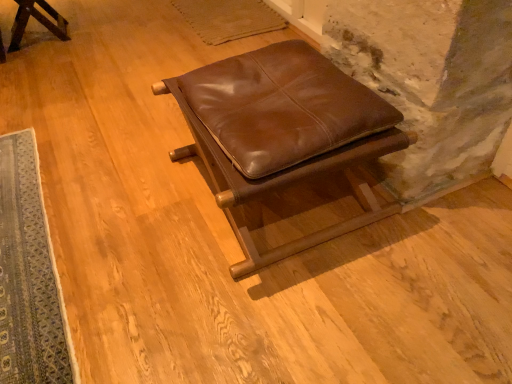
Measure the distance between matte brown leather stool at upper left, the first furniture when ordered from top to bottom, and camera.

They are 7.03 feet apart.

The width and height of the screenshot is (512, 384). Describe the element at coordinates (29, 275) in the screenshot. I see `blue woven rug at lower left` at that location.

Locate an element on the screen. Image resolution: width=512 pixels, height=384 pixels. matte brown leather stool at upper left, the 1th furniture viewed from the left is located at coordinates (37, 20).

Looking at the image, does blue woven rug at lower left seem bigger or smaller compared to brown leather ottoman at center, which appears as the first furniture when viewed from the front?

blue woven rug at lower left is smaller than brown leather ottoman at center, which appears as the first furniture when viewed from the front.

At what (x,y) coordinates should I click in order to perform the action: click on furniture in front of the blue woven rug at lower left. Please return your answer as a coordinate pair (x, y). The image size is (512, 384). Looking at the image, I should click on pyautogui.click(x=280, y=119).

Which is more to the left, blue woven rug at lower left or brown leather ottoman at center, arranged as the second furniture when viewed from the left?

From the viewer's perspective, blue woven rug at lower left appears more on the left side.

Is blue woven rug at lower left not close to brown leather ottoman at center, which is the first furniture in right-to-left order?

Actually, blue woven rug at lower left and brown leather ottoman at center, which is the first furniture in right-to-left order, are a little close together.

Considering the relative sizes of matte brown leather stool at upper left, marked as the second furniture in a front-to-back arrangement, and blue woven rug at lower left in the image provided, is matte brown leather stool at upper left, marked as the second furniture in a front-to-back arrangement, thinner than blue woven rug at lower left?

Indeed, matte brown leather stool at upper left, marked as the second furniture in a front-to-back arrangement, has a lesser width compared to blue woven rug at lower left.

Is point (17, 34) farther from camera compared to point (45, 273)?

Yes, it is behind point (45, 273).

Would you say matte brown leather stool at upper left, placed as the 2th furniture when sorted from bottom to top, contains blue woven rug at lower left?

No, matte brown leather stool at upper left, placed as the 2th furniture when sorted from bottom to top, does not contain blue woven rug at lower left.

From the picture: Does brown leather ottoman at center, the 2th furniture from the top, touch blue woven rug at lower left?

No, brown leather ottoman at center, the 2th furniture from the top, is not touching blue woven rug at lower left.

Who is taller, brown leather ottoman at center, arranged as the second furniture when viewed from the left, or blue woven rug at lower left?

Standing taller between the two is brown leather ottoman at center, arranged as the second furniture when viewed from the left.

From a real-world perspective, does brown leather ottoman at center, the 2th furniture from the top, stand above blue woven rug at lower left?

Yes, from a real-world perspective, brown leather ottoman at center, the 2th furniture from the top, is on top of blue woven rug at lower left.

Which object is wider, brown leather ottoman at center, the 2th furniture from the top, or blue woven rug at lower left?

blue woven rug at lower left.

Between point (395, 117) and point (0, 41), which one is positioned behind?

The point (0, 41) is farther from the camera.

Can you confirm if brown leather ottoman at center, which ranks as the first furniture in bottom-to-top order, is thinner than matte brown leather stool at upper left, the 1th furniture viewed from the left?

In fact, brown leather ottoman at center, which ranks as the first furniture in bottom-to-top order, might be wider than matte brown leather stool at upper left, the 1th furniture viewed from the left.

From a real-world perspective, does brown leather ottoman at center, which ranks as the first furniture in bottom-to-top order, stand above matte brown leather stool at upper left, placed as the 2th furniture when sorted from bottom to top?

Yes, from a real-world perspective, brown leather ottoman at center, which ranks as the first furniture in bottom-to-top order, is on top of matte brown leather stool at upper left, placed as the 2th furniture when sorted from bottom to top.

Is brown leather ottoman at center, which appears as the first furniture when viewed from the front, at the right side of matte brown leather stool at upper left, placed as the 2th furniture when sorted from right to left?

Yes, brown leather ottoman at center, which appears as the first furniture when viewed from the front, is to the right of matte brown leather stool at upper left, placed as the 2th furniture when sorted from right to left.

From a real-world perspective, is matte brown leather stool at upper left, placed as the 2th furniture when sorted from bottom to top, positioned over brown leather ottoman at center, which appears as the first furniture when viewed from the front, based on gravity?

No, from a real-world perspective, matte brown leather stool at upper left, placed as the 2th furniture when sorted from bottom to top, is not above brown leather ottoman at center, which appears as the first furniture when viewed from the front.

Is matte brown leather stool at upper left, placed as the 2th furniture when sorted from bottom to top, looking in the opposite direction of brown leather ottoman at center, arranged as the second furniture when viewed from the left?

No, brown leather ottoman at center, arranged as the second furniture when viewed from the left, is not at the back of matte brown leather stool at upper left, placed as the 2th furniture when sorted from bottom to top.

From the image's perspective, relative to brown leather ottoman at center, arranged as the second furniture when viewed from the left, is matte brown leather stool at upper left, the 1th furniture viewed from the left, above or below?

matte brown leather stool at upper left, the 1th furniture viewed from the left, is situated higher than brown leather ottoman at center, arranged as the second furniture when viewed from the left, in the image.

In the image, is blue woven rug at lower left positioned in front of or behind matte brown leather stool at upper left, placed as the 2th furniture when sorted from right to left?

In the image, blue woven rug at lower left appears in front of matte brown leather stool at upper left, placed as the 2th furniture when sorted from right to left.

The height and width of the screenshot is (384, 512). I want to click on the 2nd furniture above the blue woven rug at lower left (from the image's perspective), so click(x=37, y=20).

From the image's perspective, is blue woven rug at lower left located beneath matte brown leather stool at upper left, marked as the second furniture in a front-to-back arrangement?

Yes, from the image's perspective, blue woven rug at lower left is beneath matte brown leather stool at upper left, marked as the second furniture in a front-to-back arrangement.

Find the location of a particular element. This screenshot has height=384, width=512. mat on the left of brown leather ottoman at center, which ranks as the first furniture in bottom-to-top order is located at coordinates (29, 275).

At what (x,y) coordinates should I click in order to perform the action: click on mat in front of the matte brown leather stool at upper left, the first furniture when ordered from top to bottom. Please return your answer as a coordinate pair (x, y). Image resolution: width=512 pixels, height=384 pixels. Looking at the image, I should click on (29, 275).

Looking at this image, looking at the image, which one is located closer to matte brown leather stool at upper left, the 1th furniture in the back-to-front sequence, brown leather ottoman at center, the 2th furniture from the top, or blue woven rug at lower left?

The object closer to matte brown leather stool at upper left, the 1th furniture in the back-to-front sequence, is blue woven rug at lower left.

From the image, which object appears to be nearer to brown leather ottoman at center, arranged as the second furniture when viewed from the left, blue woven rug at lower left or matte brown leather stool at upper left, marked as the second furniture in a front-to-back arrangement?

blue woven rug at lower left is closer to brown leather ottoman at center, arranged as the second furniture when viewed from the left.

Considering their positions, is matte brown leather stool at upper left, placed as the 2th furniture when sorted from bottom to top, positioned closer to blue woven rug at lower left than brown leather ottoman at center, the 2th furniture from the top?

brown leather ottoman at center, the 2th furniture from the top, lies closer to blue woven rug at lower left than the other object.

When comparing their distances from brown leather ottoman at center, which is the first furniture in right-to-left order, does matte brown leather stool at upper left, placed as the 2th furniture when sorted from right to left, or blue woven rug at lower left seem further?

matte brown leather stool at upper left, placed as the 2th furniture when sorted from right to left, is positioned further to the anchor brown leather ottoman at center, which is the first furniture in right-to-left order.

From the image, which object appears to be nearer to blue woven rug at lower left, brown leather ottoman at center, the 2th furniture from the top, or matte brown leather stool at upper left, marked as the second furniture in a front-to-back arrangement?

Based on the image, brown leather ottoman at center, the 2th furniture from the top, appears to be nearer to blue woven rug at lower left.

Considering their positions, is blue woven rug at lower left positioned further to matte brown leather stool at upper left, the 1th furniture viewed from the left, than brown leather ottoman at center, the 2th furniture from the top?

brown leather ottoman at center, the 2th furniture from the top, is positioned further to the anchor matte brown leather stool at upper left, the 1th furniture viewed from the left.

Locate an element on the screen. mat positioned between brown leather ottoman at center, which ranks as the first furniture in bottom-to-top order, and matte brown leather stool at upper left, placed as the 2th furniture when sorted from bottom to top, from near to far is located at coordinates (29, 275).